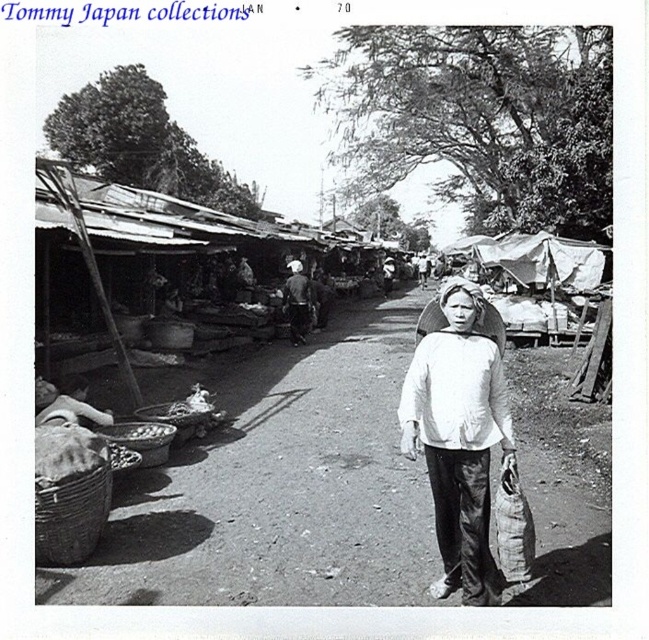
The width and height of the screenshot is (649, 640). I want to click on white cotton shirt at center, so click(x=459, y=435).

Who is more forward, [459,580] or [308,296]?

Positioned in front is point [459,580].

Between point (447, 328) and point (297, 332), which one is positioned behind?

The point (297, 332) is behind.

The image size is (649, 640). What are the coordinates of `white cotton shirt at center` in the screenshot? It's located at pyautogui.click(x=459, y=435).

Is the position of white fabric bag at center more distant than that of dark gray fabric bag at center?

No, it is in front of dark gray fabric bag at center.

Does point (275, 484) come behind point (306, 305)?

No.

I want to click on white fabric bag at center, so click(x=282, y=488).

In the scene shown: Is white fabric bag at center positioned behind white cotton shirt at center?

Yes, it is.

Which is below, white fabric bag at center or white cotton shirt at center?

Positioned lower is white fabric bag at center.

Who is more forward, (123, 593) or (465, 534)?

Point (465, 534) is more forward.

Find the location of a particular element. The height and width of the screenshot is (640, 649). white fabric bag at center is located at coordinates (282, 488).